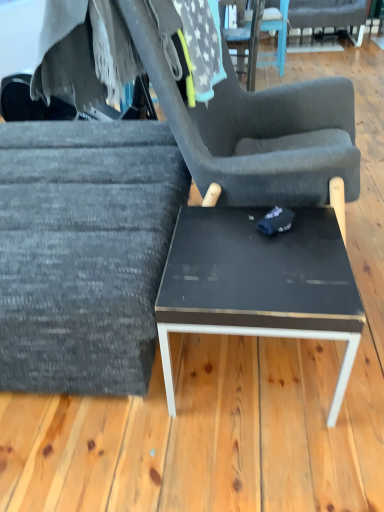
You are a GUI agent. You are given a task and a screenshot of the screen. Output one action in this format:
    pyautogui.click(x=<x>, y=<y>)
    Task: Click on the free space above black glossy table at center (from a real-world perspective)
    
    Given the screenshot: What is the action you would take?
    pyautogui.click(x=253, y=250)